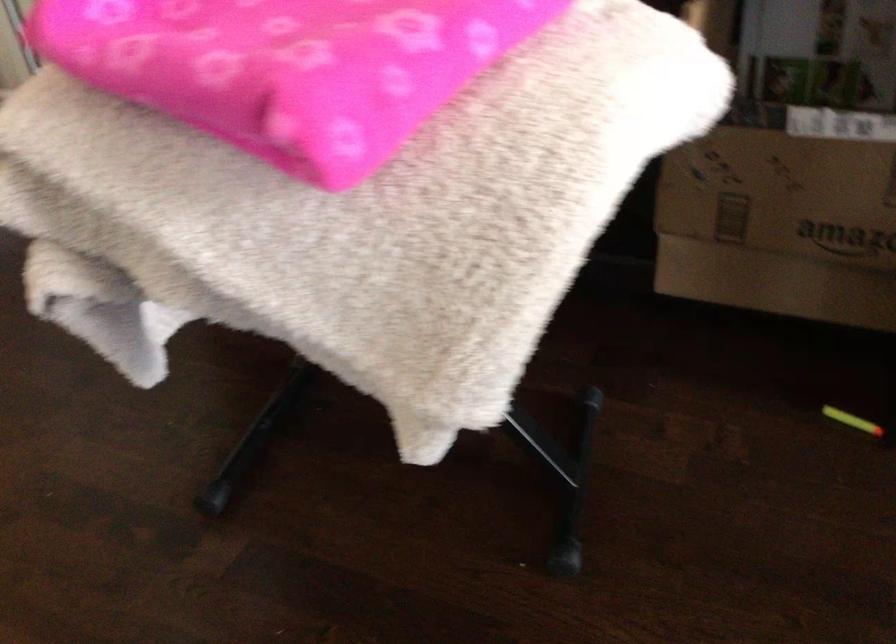
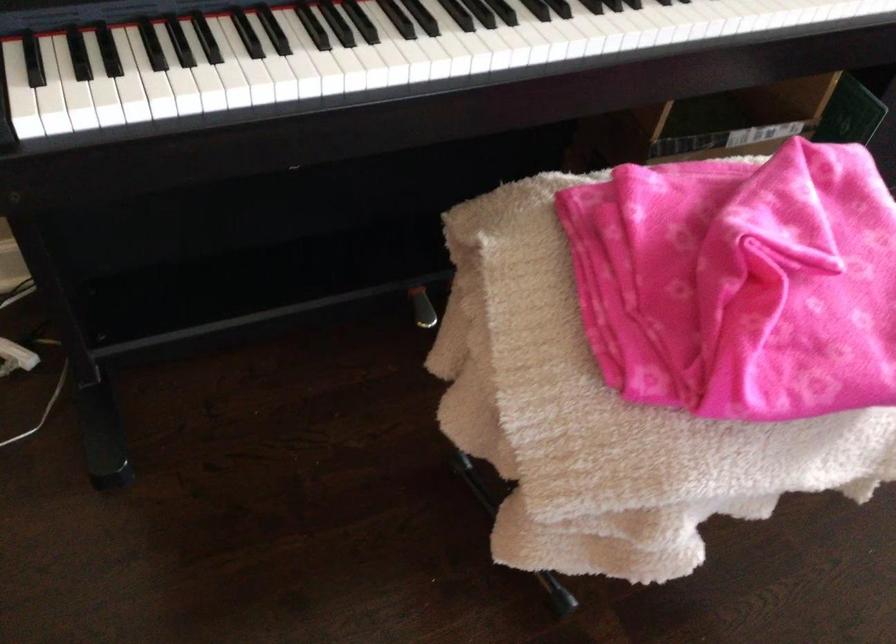
Question: I am providing you with two images of the same scene from different viewpoints. Please identify which objects are invisible in image2.

Choices:
 (A) cardboard amazon box
 (B) piano keys
 (C) spherical table lamp
 (D) pink folded blanket

Answer: (A)